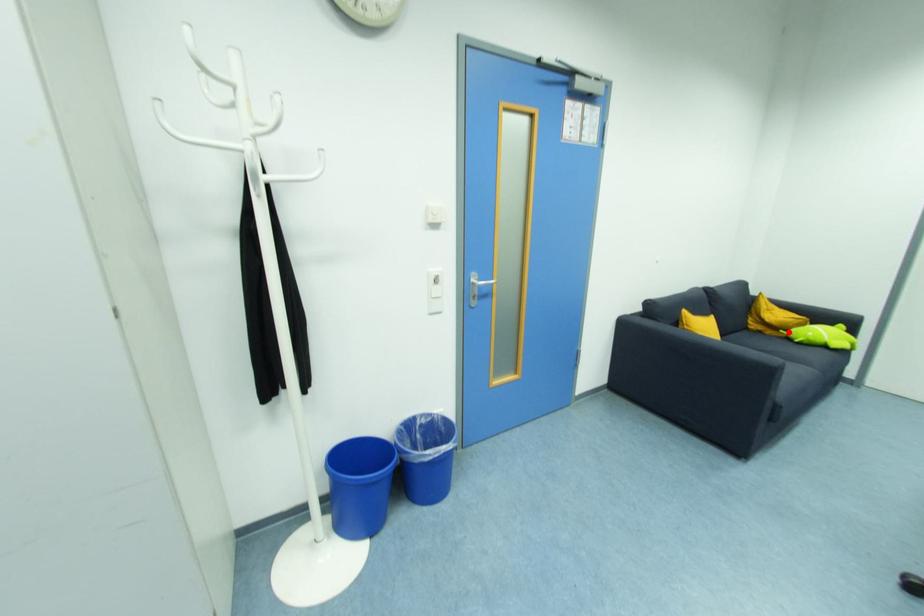
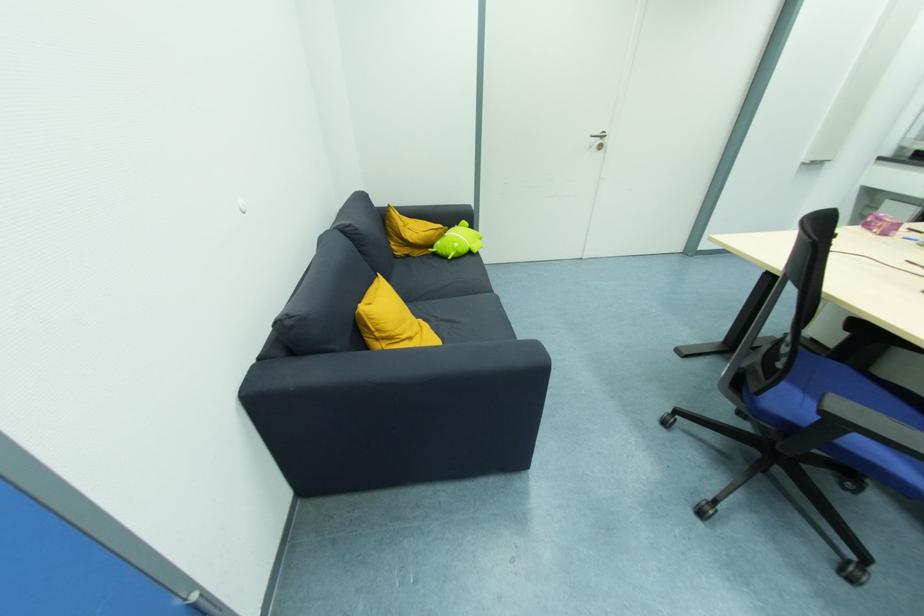
Where in the second image is the point corresponding to the highlighted location from the first image?

(435, 248)